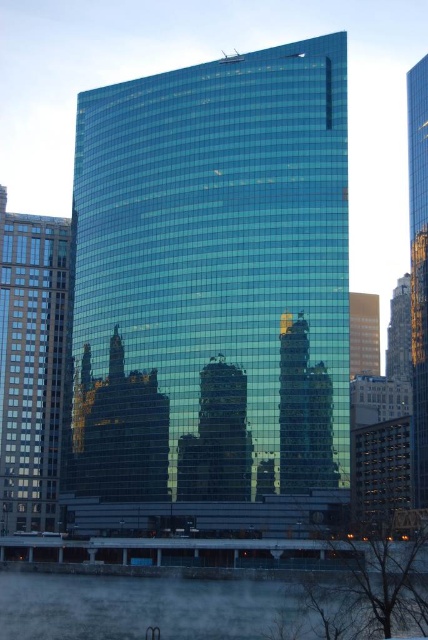
Question: Does matte glass skyscraper at left have a smaller size compared to shiny glass skyscraper at center?

Choices:
 (A) no
 (B) yes

Answer: (B)

Question: Is matte glass skyscraper at left below reflective glass skyscraper at right?

Choices:
 (A) no
 (B) yes

Answer: (B)

Question: Which object appears closest to the camera in this image?

Choices:
 (A) shiny glass skyscraper at center
 (B) shiny glass skyscraper at right
 (C) reflective glass skyscraper at right
 (D) shiny glass tower at center

Answer: (D)

Question: Which point is farther from the camera taking this photo?

Choices:
 (A) (359, 342)
 (B) (427, 397)
 (C) (398, 296)
 (D) (240, 333)

Answer: (C)

Question: Does reflective glass skyscraper at right appear under shiny glass skyscraper at center?

Choices:
 (A) no
 (B) yes

Answer: (A)

Question: Which point is farther to the camera?

Choices:
 (A) shiny glass skyscraper at center
 (B) shiny glass tower at center
 (C) reflective glass skyscraper at right

Answer: (C)